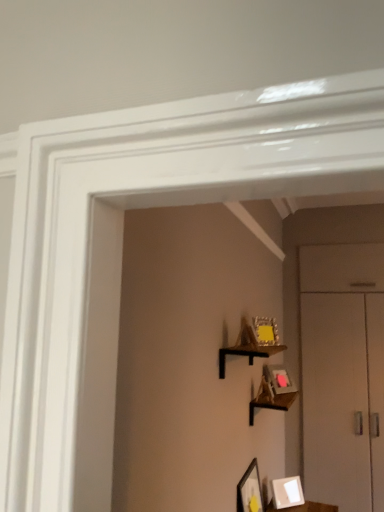
Question: From a real-world perspective, is matte black picture frame at lower center, the 2th picture frame from the bottom, positioned above or below wooden picture frame at center, the 5th picture frame ordered from the bottom?

Choices:
 (A) above
 (B) below

Answer: (B)

Question: In the image, is matte black picture frame at lower center, the 2th picture frame from the bottom, positioned in front of or behind wooden picture frame at center, the 5th picture frame ordered from the bottom?

Choices:
 (A) front
 (B) behind

Answer: (B)

Question: Which object is the farthest from the matte black picture frame at lower center, placed as the 4th picture frame when sorted from top to bottom?

Choices:
 (A) wooden shelf at upper center, which is the 1th shelf in top-to-bottom order
 (B) wooden shelf at center, which is counted as the 2th shelf, starting from the top
 (C) white matte picture frame at lower center, marked as the 5th picture frame in a top-to-bottom arrangement
 (D) wooden picture frame at center, the 1th picture frame when ordered from top to bottom
 (E) matte gold picture frame at upper center, the 4th picture frame when ordered from bottom to top

Answer: (D)

Question: Estimate the real-world distances between objects in this image. Which object is farther from the matte gold picture frame at upper right, which is the third picture frame from top to bottom?

Choices:
 (A) wooden picture frame at center, the 5th picture frame ordered from the bottom
 (B) wooden shelf at center, which is the 1th shelf from bottom to top
 (C) white matte picture frame at lower center, marked as the 5th picture frame in a top-to-bottom arrangement
 (D) matte black picture frame at lower center, placed as the 4th picture frame when sorted from top to bottom
 (E) matte gold picture frame at upper center, the 4th picture frame when ordered from bottom to top

Answer: (A)